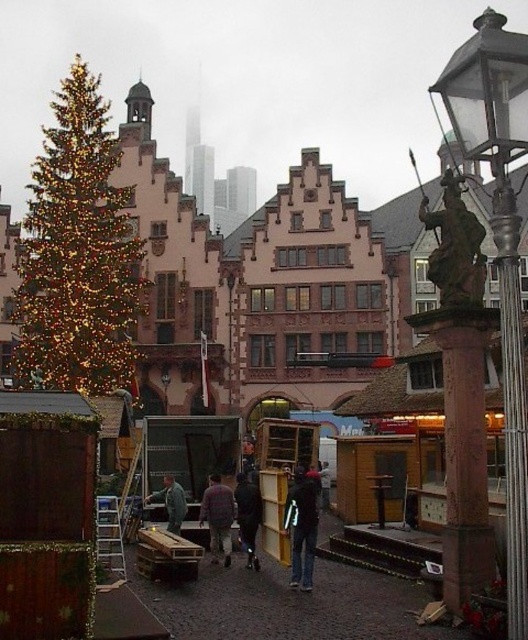
You are standing at the center of the market scene. There is a point marked at coordinates (301, 525). What object is located at that point?

The point at coordinates (301, 525) corresponds to dark blue jeans at center.